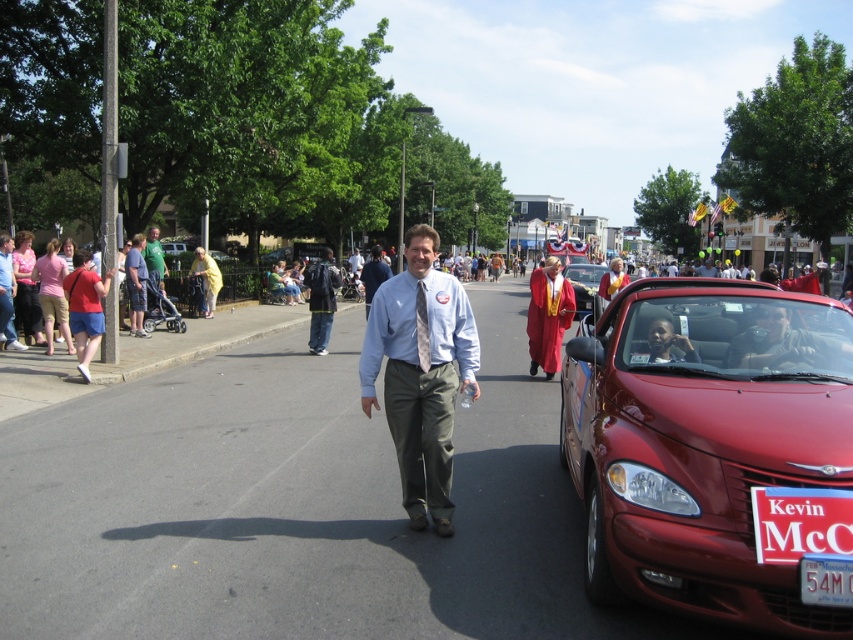
Question: Based on their relative distances, which object is farther from the matte red shorts at left?

Choices:
 (A) dark blue jeans at center
 (B) yellow fabric at left

Answer: (B)

Question: Among these objects, which one is farthest from the camera?

Choices:
 (A) dark blue jeans at center
 (B) metallic silver stroller at left

Answer: (B)

Question: Which object is positioned closest to the metallic silver stroller at left?

Choices:
 (A) shiny red convertible at center
 (B) matte black sunglasses at center
 (C) white plastic license plate at lower right
 (D) matte gold graduation gown at center

Answer: (D)

Question: Is light blue shirt at center wider than yellow fabric at left?

Choices:
 (A) no
 (B) yes

Answer: (A)

Question: Where is dark blue jeans at center located in relation to matte blue shirt at left in the image?

Choices:
 (A) right
 (B) left

Answer: (A)

Question: Does dark blue jeans at center have a smaller size compared to smooth skin face at center?

Choices:
 (A) no
 (B) yes

Answer: (A)